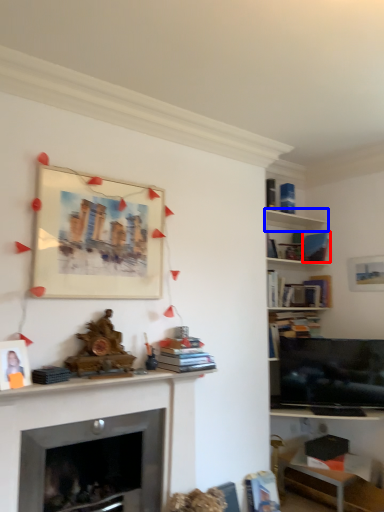
Question: Among these objects, which one is nearest to the camera, book (highlighted by a red box) or shelf (highlighted by a blue box)?

Choices:
 (A) book
 (B) shelf

Answer: (B)